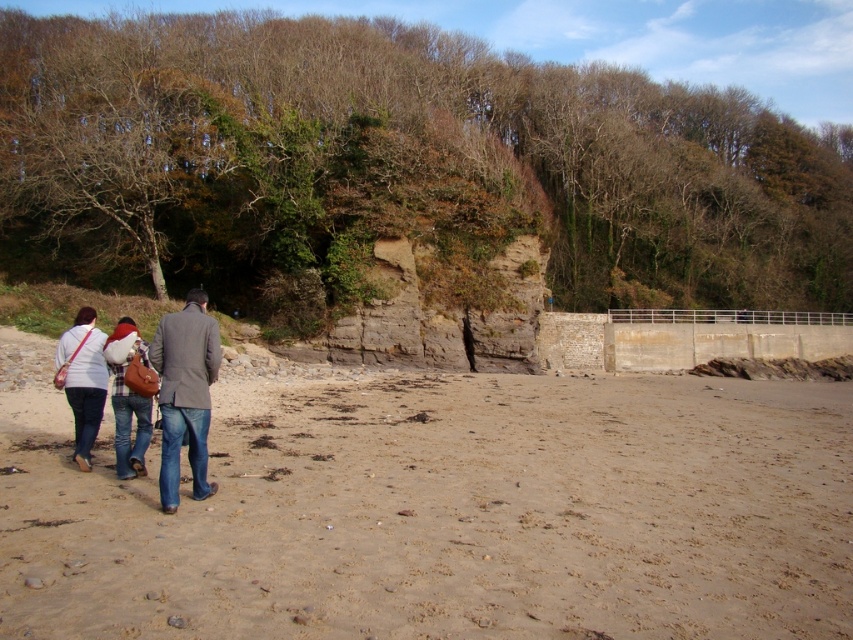
You are a photographer trying to capture a group photo of the matte white shirt at lower left and the denim jacket at left. The camera you are using has a maximum focus range of 30 inches. Will you be able to get both subjects in focus without moving either of them?

The matte white shirt at lower left is 31.12 inches from the denim jacket at left. Since the distance between them exceeds the camera maximum focus range of 30 inches, you will not be able to get both subjects in focus without moving them closer together.

You are a photographer trying to capture a wide shot of the beach scene. You notice the sandy at left and denim jacket at left in your frame. Considering their widths, which object would you need to adjust your camera angle to include more of in the shot?

The sandy at left is wider than the denim jacket at left, so you would need to adjust your camera angle to include more of the sandy at left in the shot.